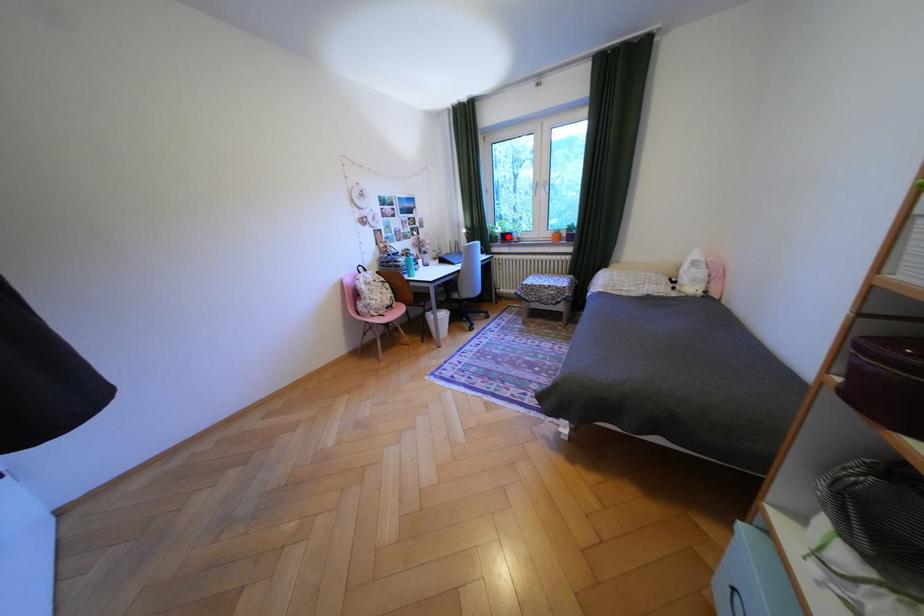
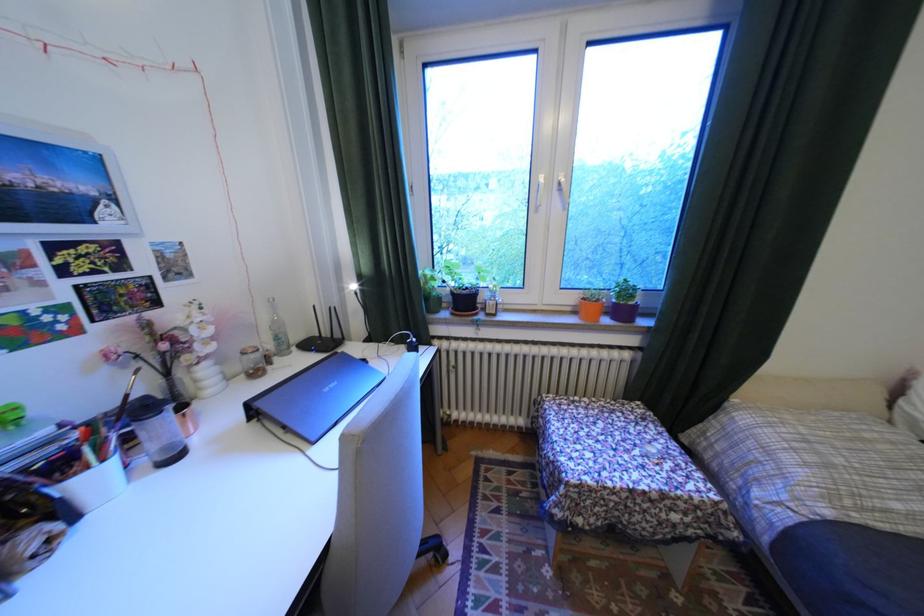
Question: I am providing you with two images of the same scene from different viewpoints. Image1 has a red point marked. In image2, the corresponding 3D location appears at what relative position? Reply with the corresponding letter.

Choices:
 (A) Closer
 (B) Farther

Answer: (B)